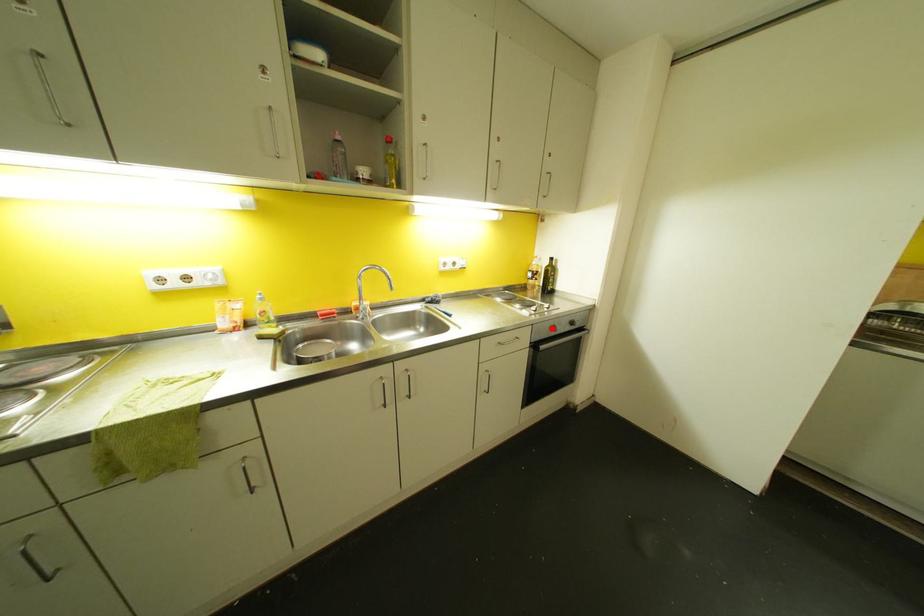
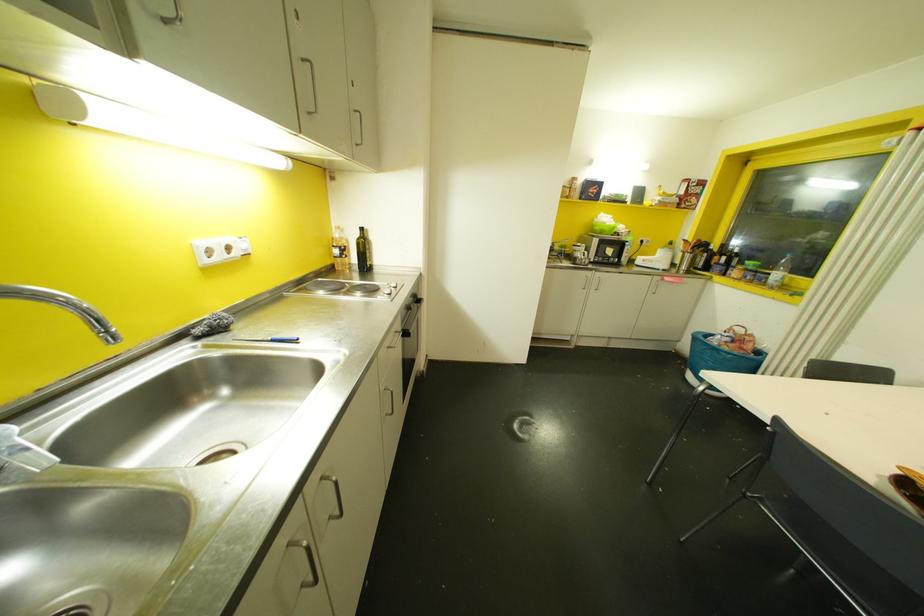
In the second image, find the point that corresponds to the highlighted location in the first image.

(407, 307)